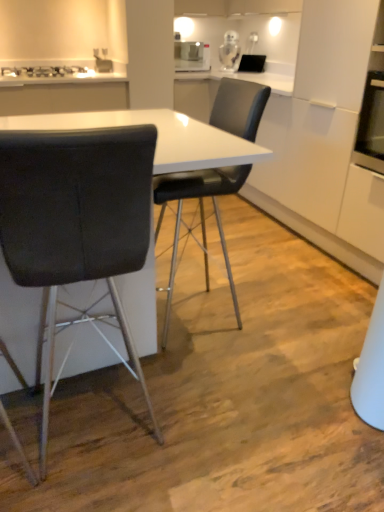
Identify the location of free point to the right of white glossy table at center. The height and width of the screenshot is (512, 384). (295, 342).